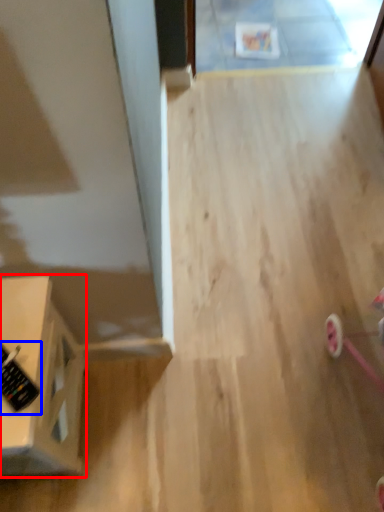
Question: Among these objects, which one is farthest to the camera, furniture (highlighted by a red box) or control (highlighted by a blue box)?

Choices:
 (A) furniture
 (B) control

Answer: (B)